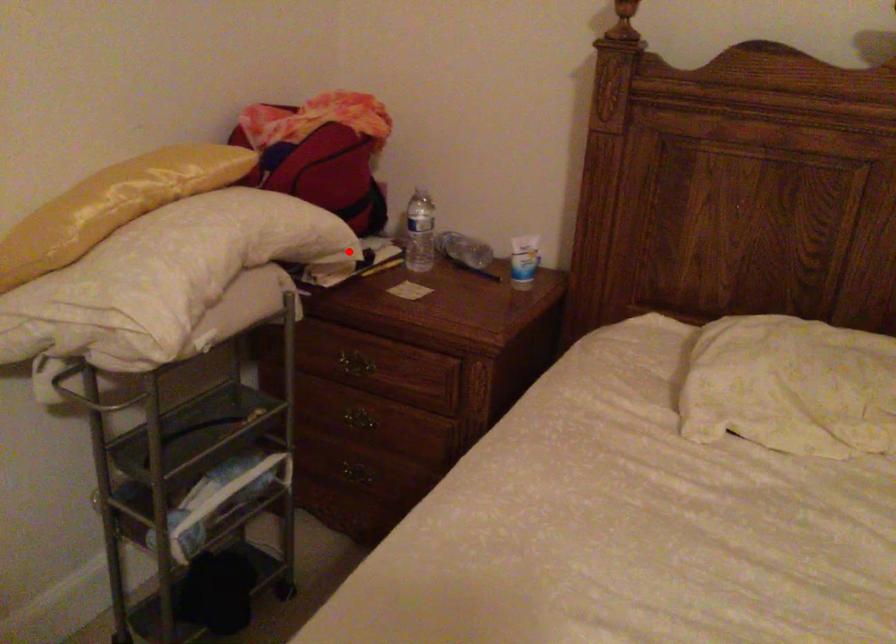
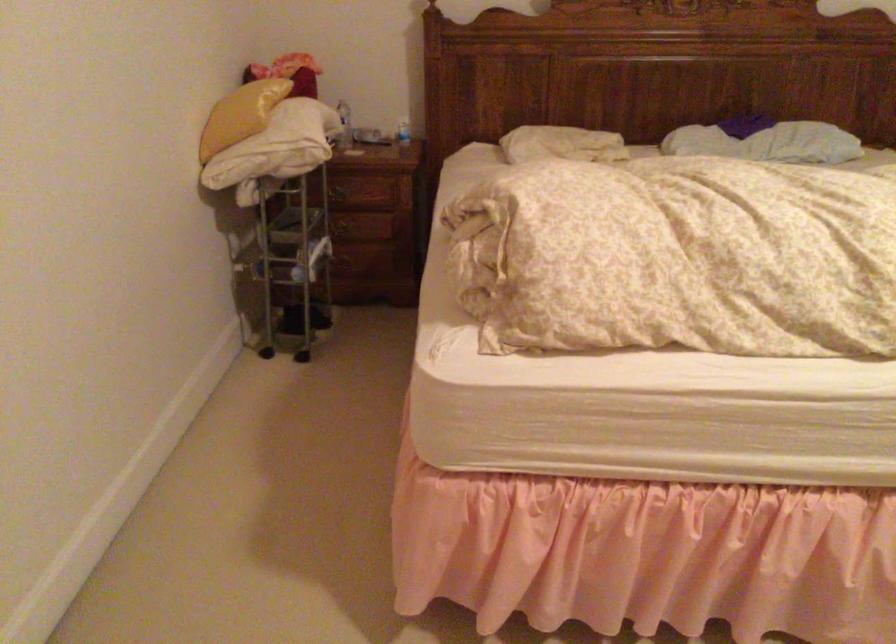
Question: I am providing you with two images of the same scene from different viewpoints. In image1, a red point is highlighted. Considering the same 3D point in image2, which of the following is correct?

Choices:
 (A) It is closer
 (B) It is farther

Answer: (B)